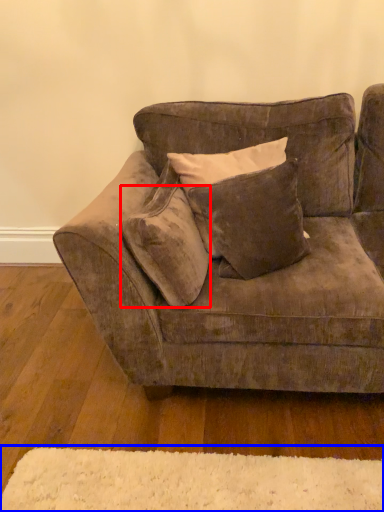
Question: Which object is closer to the camera taking this photo, pillow (highlighted by a red box) or mat (highlighted by a blue box)?

Choices:
 (A) pillow
 (B) mat

Answer: (B)